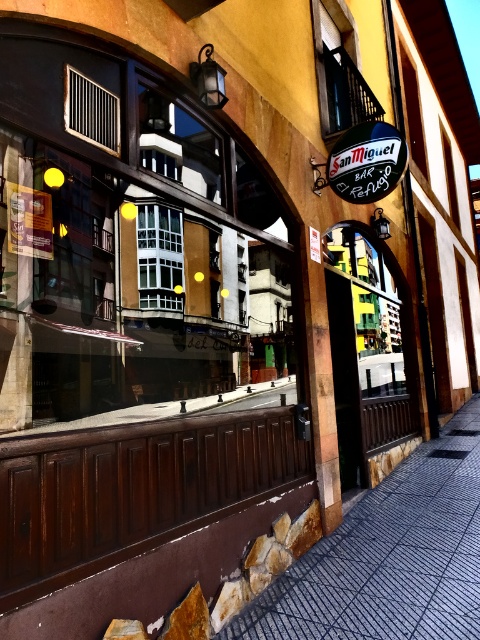
Question: Is dark gray textured pavement at lower center behind matte black vent at upper left?

Choices:
 (A) no
 (B) yes

Answer: (B)

Question: Estimate the real-world distances between objects in this image. Which object is farther from the matte black window at upper center?

Choices:
 (A) dark gray textured pavement at lower center
 (B) black matte sign at upper center
 (C) matte black vent at upper left
 (D) white glass window at center

Answer: (A)

Question: Among these points, which one is nearest to the camera?

Choices:
 (A) (404, 160)
 (B) (470, 566)
 (C) (68, 115)

Answer: (C)

Question: Estimate the real-world distances between objects in this image. Which object is closer to the matte black window at upper center?

Choices:
 (A) black matte sign at upper center
 (B) matte black vent at upper left
 (C) dark gray textured pavement at lower center
 (D) white glass window at center

Answer: (A)

Question: Is dark gray textured pavement at lower center bigger than matte black window at upper center?

Choices:
 (A) no
 (B) yes

Answer: (A)

Question: Can you confirm if matte black window at upper center is bigger than black matte sign at upper center?

Choices:
 (A) no
 (B) yes

Answer: (B)